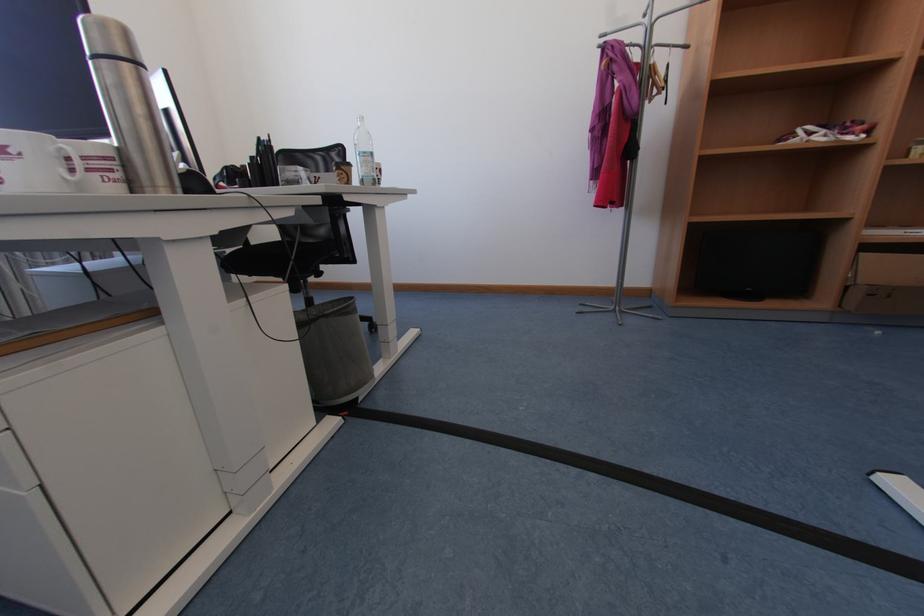
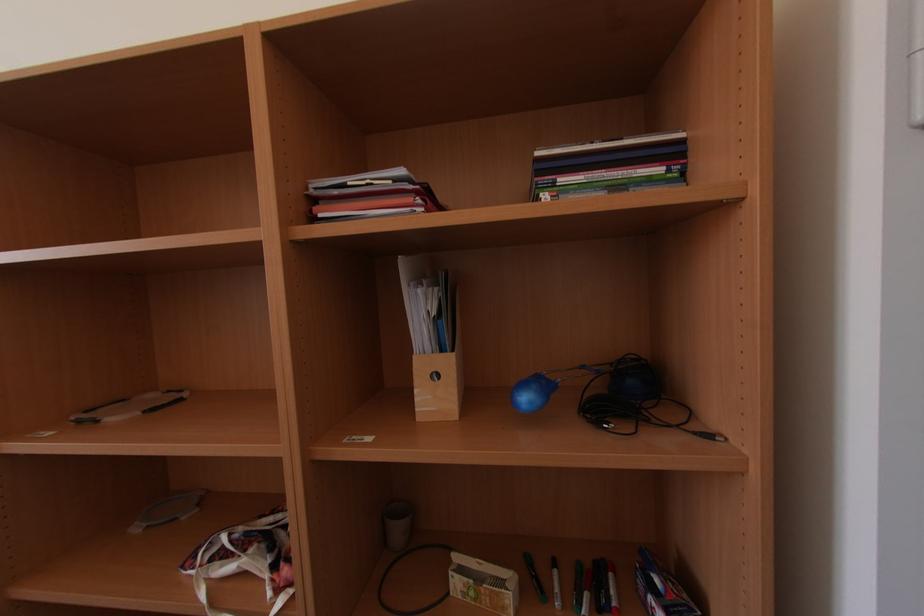
Question: Which direction would the cameraman need to move to produce the second image? Reply with the corresponding letter.

Choices:
 (A) Left
 (B) Right
 (C) Forward
 (D) Backward

Answer: (B)